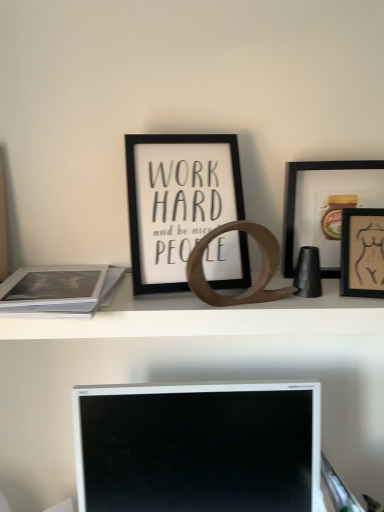
The image size is (384, 512). Find the location of `free location above white matte paper at left (from a real-world perspective)`. free location above white matte paper at left (from a real-world perspective) is located at coordinates (49, 287).